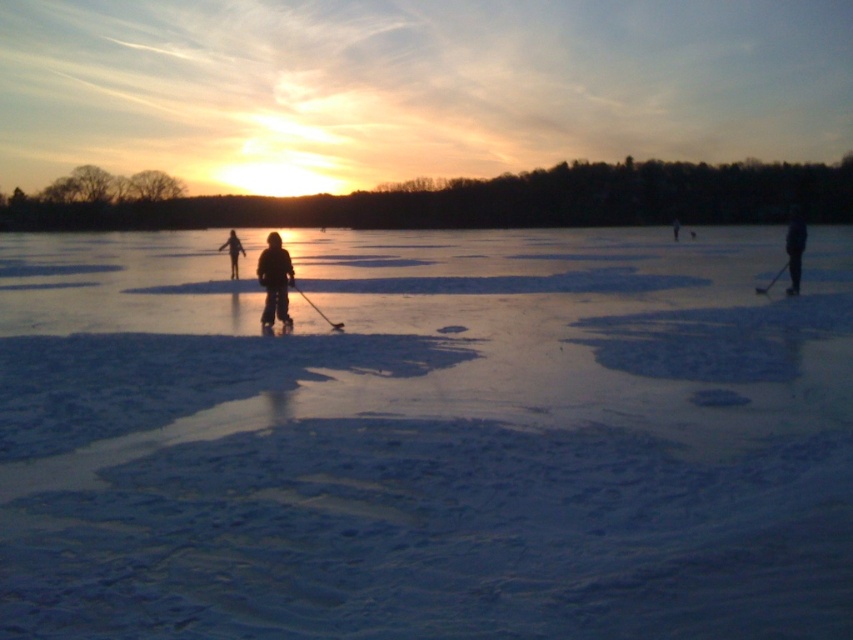
Which of these two, white matte ice at center or black matte snowsuit at center, stands shorter?

black matte snowsuit at center

Between point (780, 387) and point (288, 324), which one is positioned behind?

Positioned behind is point (288, 324).

Between point (759, 536) and point (276, 280), which one is positioned in front?

Positioned in front is point (759, 536).

This screenshot has width=853, height=640. What are the coordinates of `white matte ice at center` in the screenshot? It's located at (426, 436).

This screenshot has height=640, width=853. What do you see at coordinates (426, 436) in the screenshot?
I see `white matte ice at center` at bounding box center [426, 436].

Is point (482, 572) positioned behind point (793, 214)?

No, (482, 572) is in front of (793, 214).

Where is `white matte ice at center`? white matte ice at center is located at coordinates (426, 436).

Does black matte snowsuit at center come behind dark blue jacket at right?

No, it is in front of dark blue jacket at right.

Between black matte snowsuit at center and dark blue jacket at right, which one appears on the left side from the viewer's perspective?

From the viewer's perspective, black matte snowsuit at center appears more on the left side.

Between point (273, 292) and point (795, 227), which one is positioned behind?

The point (795, 227) is more distant.

Find the location of `black matte snowsuit at center`. black matte snowsuit at center is located at coordinates (274, 280).